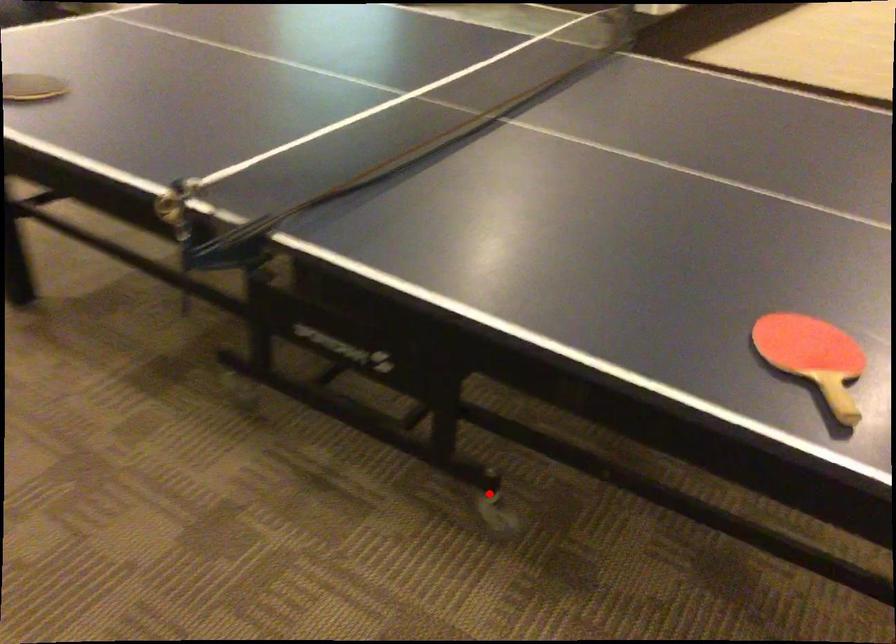
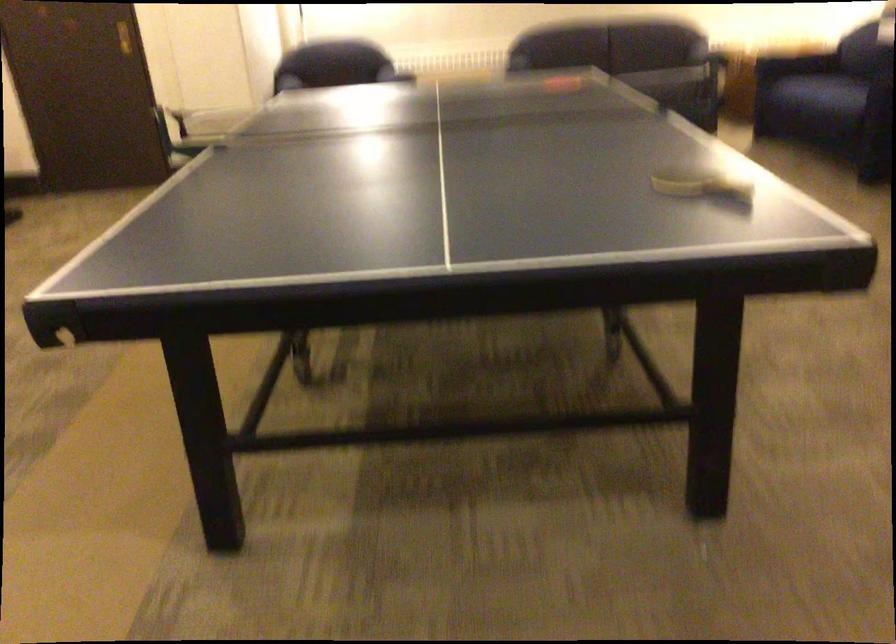
Question: I am providing you with two images of the same scene from different viewpoints. A red point is marked on the first image. Can you still see the location of the red point in image 2?

Choices:
 (A) Yes
 (B) No

Answer: (B)